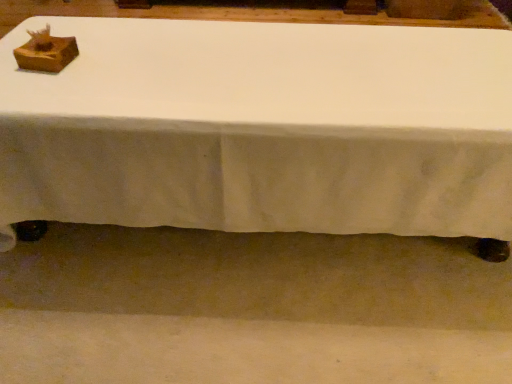
Question: Considering the positions of wooden box at upper left and white fabric table at center in the image, is wooden box at upper left wider or thinner than white fabric table at center?

Choices:
 (A) thin
 (B) wide

Answer: (A)

Question: In the image, is wooden box at upper left positioned in front of or behind white fabric table at center?

Choices:
 (A) front
 (B) behind

Answer: (B)

Question: In terms of size, does wooden box at upper left appear bigger or smaller than white fabric table at center?

Choices:
 (A) small
 (B) big

Answer: (A)

Question: From a real-world perspective, relative to wooden box at upper left, is white fabric table at center vertically above or below?

Choices:
 (A) above
 (B) below

Answer: (B)

Question: Relative to wooden box at upper left, is white fabric table at center in front or behind?

Choices:
 (A) behind
 (B) front

Answer: (B)

Question: Would you say white fabric table at center is to the left or to the right of wooden box at upper left in the picture?

Choices:
 (A) right
 (B) left

Answer: (A)

Question: Looking at their shapes, would you say white fabric table at center is wider or thinner than wooden box at upper left?

Choices:
 (A) thin
 (B) wide

Answer: (B)